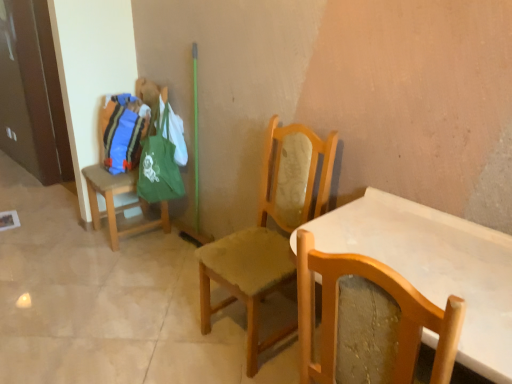
What are the coordinates of `free spot to the left of wooden chair at center, arranged as the 2th chair when viewed from the right` in the screenshot? It's located at (170, 339).